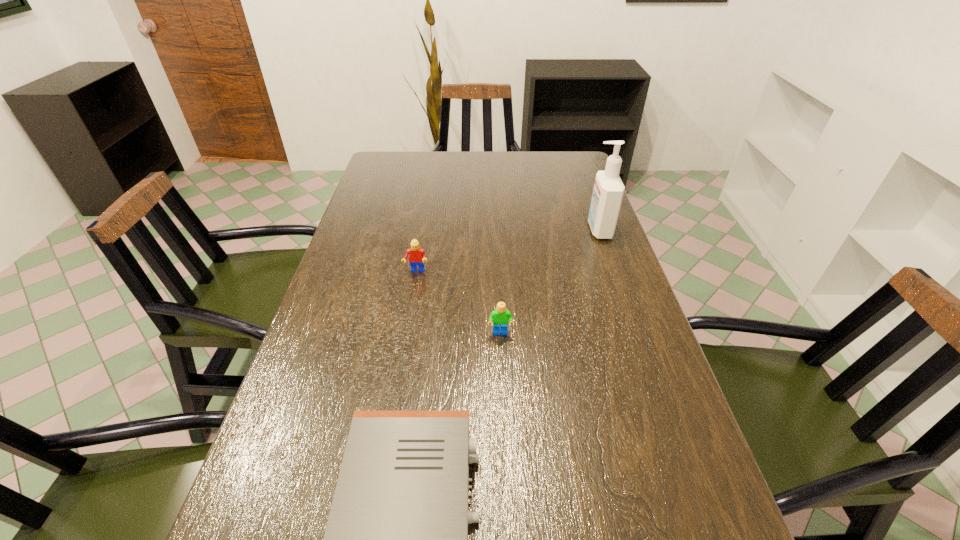
Where is `vacant space located on the face of the second nearest object`? vacant space located on the face of the second nearest object is located at coordinates (503, 393).

At what (x,y) coordinates should I click in order to perform the action: click on object located at the right edge. Please return your answer as a coordinate pair (x, y). The height and width of the screenshot is (540, 960). Looking at the image, I should click on (608, 191).

The image size is (960, 540). In the image, there is a desktop. In order to click on free space at the far edge in this screenshot , I will do `click(521, 177)`.

Locate an element on the screen. free space at the left edge is located at coordinates (387, 240).

Locate an element on the screen. Image resolution: width=960 pixels, height=540 pixels. free region at the right edge of the desktop is located at coordinates (x=600, y=298).

Where is `vacant space at the far left corner of the desktop`? vacant space at the far left corner of the desktop is located at coordinates (377, 159).

The image size is (960, 540). In the image, there is a desktop. What are the coordinates of `blank space at the far right corner` in the screenshot? It's located at (548, 155).

You are a GUI agent. You are given a task and a screenshot of the screen. Output one action in this format:
    pyautogui.click(x=<x>, y=<y>)
    Task: Click on the free point between the second farthest object and the cleansing agent
    
    Given the screenshot: What is the action you would take?
    pyautogui.click(x=508, y=251)

The image size is (960, 540). I want to click on free space between the left Lego and the tallest object, so click(x=508, y=251).

The height and width of the screenshot is (540, 960). I want to click on free space between the second object from right to left and the left Lego, so click(x=458, y=302).